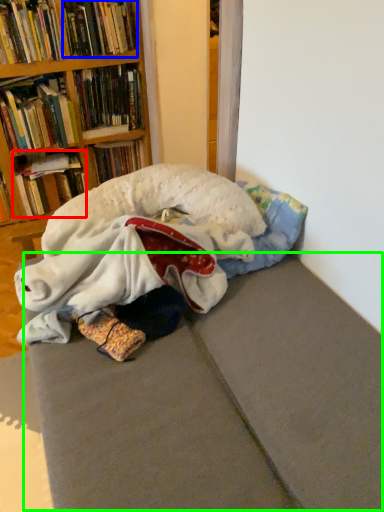
Question: Which object is the farthest from book (highlighted by a red box)? Choose among these: book (highlighted by a blue box) or bed frame (highlighted by a green box).

Choices:
 (A) book
 (B) bed frame

Answer: (B)